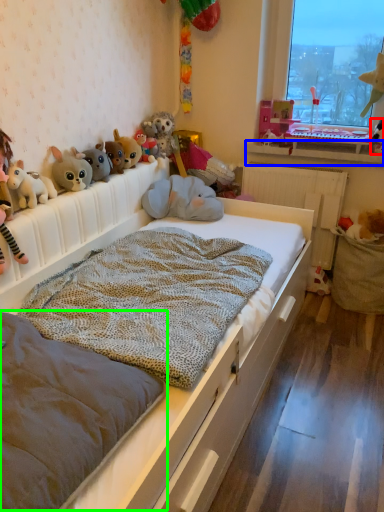
Question: Which object is positioned closest to toy (highlighted by a red box)? Select from window sill (highlighted by a blue box) and mattress (highlighted by a green box).

Choices:
 (A) window sill
 (B) mattress

Answer: (A)